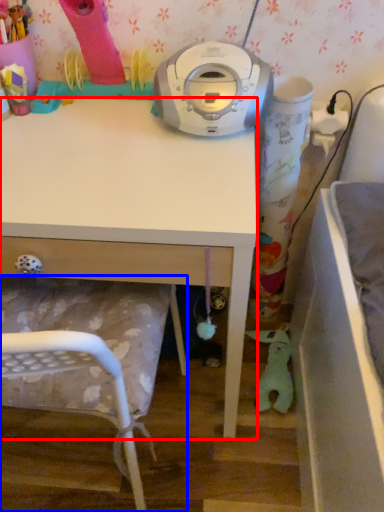
Question: Which object appears farthest to the camera in this image, desk (highlighted by a red box) or chair (highlighted by a blue box)?

Choices:
 (A) desk
 (B) chair

Answer: (A)